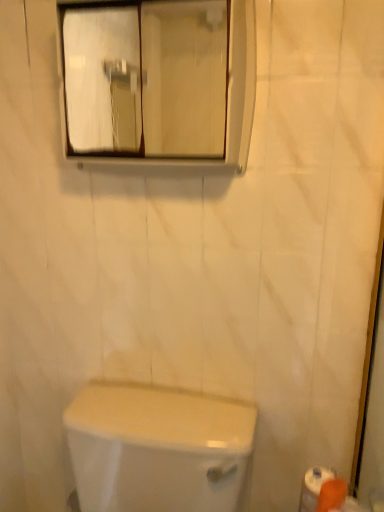
Locate an element on the screen. free space underneath clear glass mirror at upper center (from a real-world perspective) is located at coordinates (153, 396).